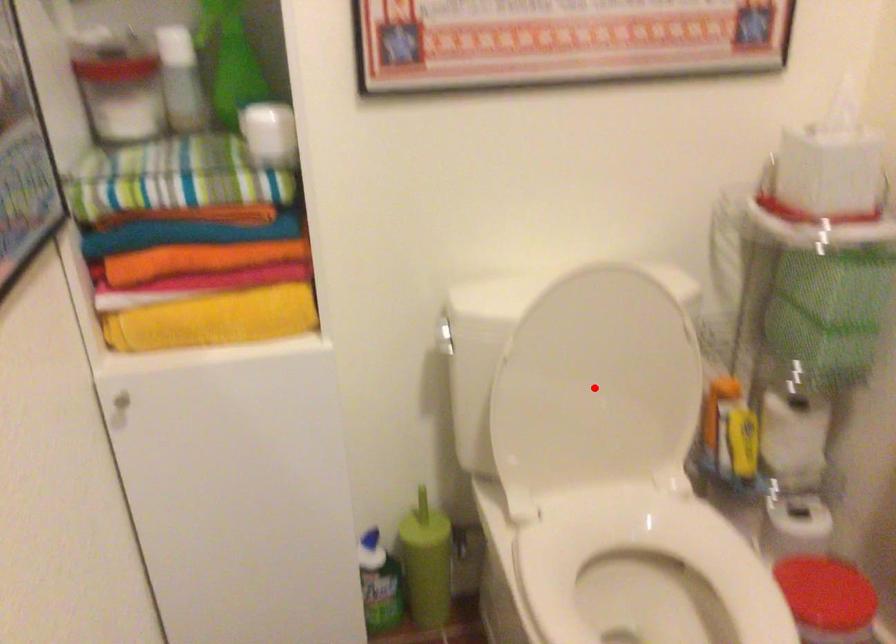
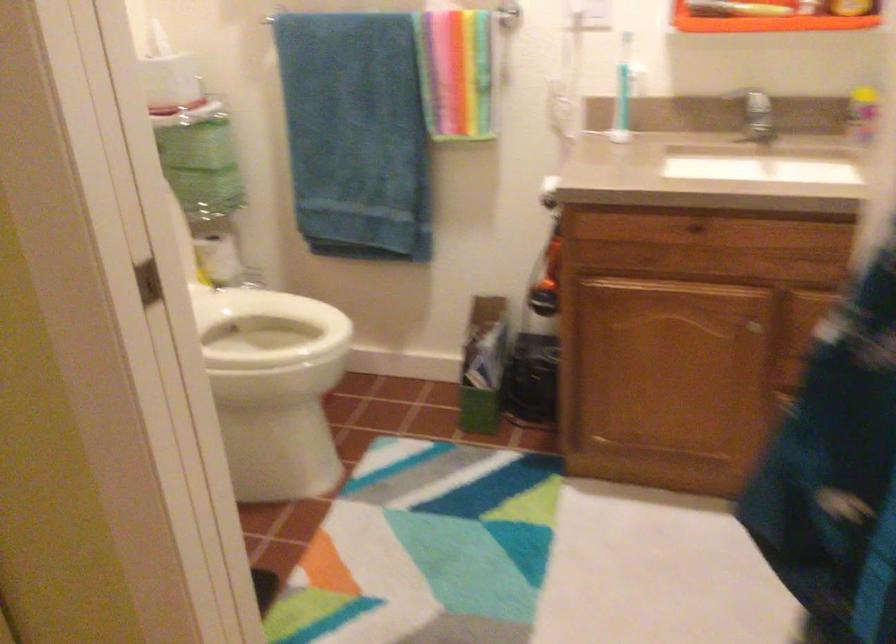
Question: I am providing you with two images of the same scene from different viewpoints. A red point is marked on the first image. At the location where the point appears in image 1, is it still visible in image 2?

Choices:
 (A) Yes
 (B) No

Answer: (B)